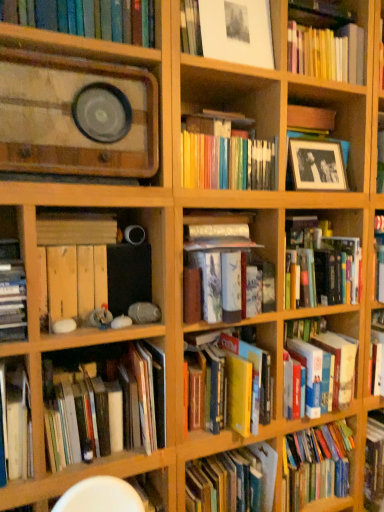
Question: Is hardcover books at lower left, acting as the 1th book starting from the bottom, next to wooden crate at lower left, the eighth book ordered from the bottom?

Choices:
 (A) no
 (B) yes

Answer: (A)

Question: Is hardcover books at lower left, placed as the 11th book when sorted from top to bottom, further to the viewer compared to wooden crate at lower left, the fourth book when ordered from top to bottom?

Choices:
 (A) yes
 (B) no

Answer: (B)

Question: From a real-world perspective, is hardcover books at lower left, acting as the 1th book starting from the bottom, on wooden crate at lower left, the fourth book when ordered from top to bottom?

Choices:
 (A) no
 (B) yes

Answer: (A)

Question: Is hardcover books at lower left, placed as the 11th book when sorted from top to bottom, not close to wooden crate at lower left, the eighth book ordered from the bottom?

Choices:
 (A) yes
 (B) no

Answer: (B)

Question: Does hardcover books at lower left, placed as the 11th book when sorted from top to bottom, have a larger size compared to wooden crate at lower left, the eighth book ordered from the bottom?

Choices:
 (A) no
 (B) yes

Answer: (B)

Question: Is hardcover book at center-right, which ranks as the third book in bottom-to-top order, to the left or to the right of hardcover book at center, positioned as the 7th book in bottom-to-top order, in the image?

Choices:
 (A) left
 (B) right

Answer: (B)

Question: From the image's perspective, is hardcover book at center-right, which ranks as the third book in bottom-to-top order, positioned above or below hardcover book at center, which appears as the fifth book when viewed from the top?

Choices:
 (A) above
 (B) below

Answer: (B)

Question: Considering the positions of point click(x=312, y=410) and point click(x=334, y=270), is point click(x=312, y=410) closer or farther from the camera than point click(x=334, y=270)?

Choices:
 (A) closer
 (B) farther

Answer: (A)

Question: From a real-world perspective, is hardcover book at center-right, which ranks as the third book in bottom-to-top order, physically located above or below hardcover book at center, positioned as the 7th book in bottom-to-top order?

Choices:
 (A) above
 (B) below

Answer: (B)

Question: Does point [269, 370] appear closer or farther from the camera than point [309, 380]?

Choices:
 (A) farther
 (B) closer

Answer: (A)

Question: From the image's perspective, is hardcover book at center, which is the 10th book in top-to-bottom order, above or below hardcover book at center-right, which ranks as the third book in bottom-to-top order?

Choices:
 (A) below
 (B) above

Answer: (A)

Question: Is hardcover book at center, which is the 10th book in top-to-bottom order, inside the boundaries of hardcover book at center-right, which appears as the 9th book when viewed from the top, or outside?

Choices:
 (A) inside
 (B) outside

Answer: (B)

Question: From a real-world perspective, is hardcover book at center, which is the 10th book in top-to-bottom order, above or below hardcover book at center-right, which appears as the 9th book when viewed from the top?

Choices:
 (A) above
 (B) below

Answer: (A)

Question: Is point (183, 38) closer or farther from the camera than point (71, 239)?

Choices:
 (A) closer
 (B) farther

Answer: (B)

Question: Would you say matte white framed picture at upper center, the 11th book when ordered from bottom to top, is to the left or to the right of wooden crate at center-left, the seventh book viewed from the top, in the picture?

Choices:
 (A) right
 (B) left

Answer: (A)